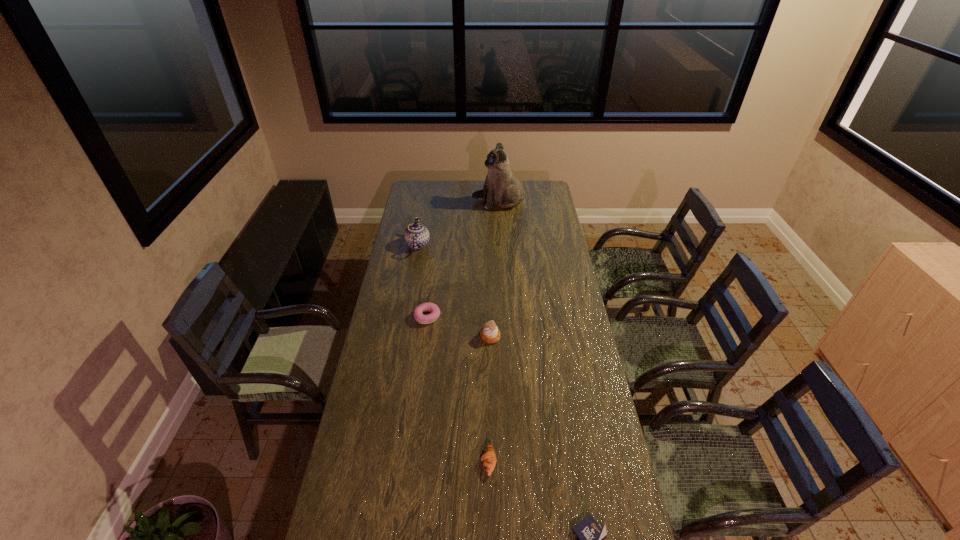
You are a GUI agent. You are given a task and a screenshot of the screen. Output one action in this format:
    pyautogui.click(x=<x>, y=<y>)
    Task: Click on the free space located at the face of the farthest object
    
    Given the screenshot: What is the action you would take?
    pyautogui.click(x=409, y=202)

This screenshot has width=960, height=540. Find the location of `free space located 0.070m at the face of the farthest object`. free space located 0.070m at the face of the farthest object is located at coordinates point(460,202).

Identify the location of vacant region located 0.250m at the spout of the fifth nearest object. This screenshot has height=540, width=960. (477, 244).

Image resolution: width=960 pixels, height=540 pixels. I want to click on vacant space located 0.080m on the left of the second farthest pastry, so click(461, 336).

The image size is (960, 540). I want to click on vacant space located on the right of the leftmost pastry, so click(511, 316).

Where is `blank area located 0.150m on the front-facing side of the nearest pastry`? blank area located 0.150m on the front-facing side of the nearest pastry is located at coordinates (435, 462).

Locate an element on the screen. The width and height of the screenshot is (960, 540). vacant space located 0.210m on the front-facing side of the nearest pastry is located at coordinates (417, 462).

The image size is (960, 540). What are the coordinates of `vacant space located 0.120m on the front-facing side of the nearest pastry` in the screenshot? It's located at (444, 462).

Locate an element on the screen. Image resolution: width=960 pixels, height=540 pixels. object that is at the far edge is located at coordinates (502, 187).

Find the location of a particular element. This screenshot has width=960, height=540. chinaware situated at the left edge is located at coordinates (416, 236).